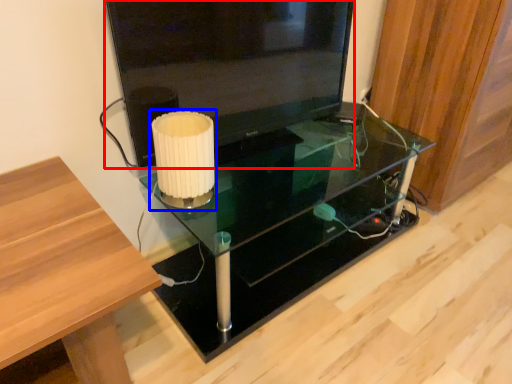
Question: Among these objects, which one is farthest to the camera, television (highlighted by a red box) or table lamp (highlighted by a blue box)?

Choices:
 (A) television
 (B) table lamp

Answer: (B)